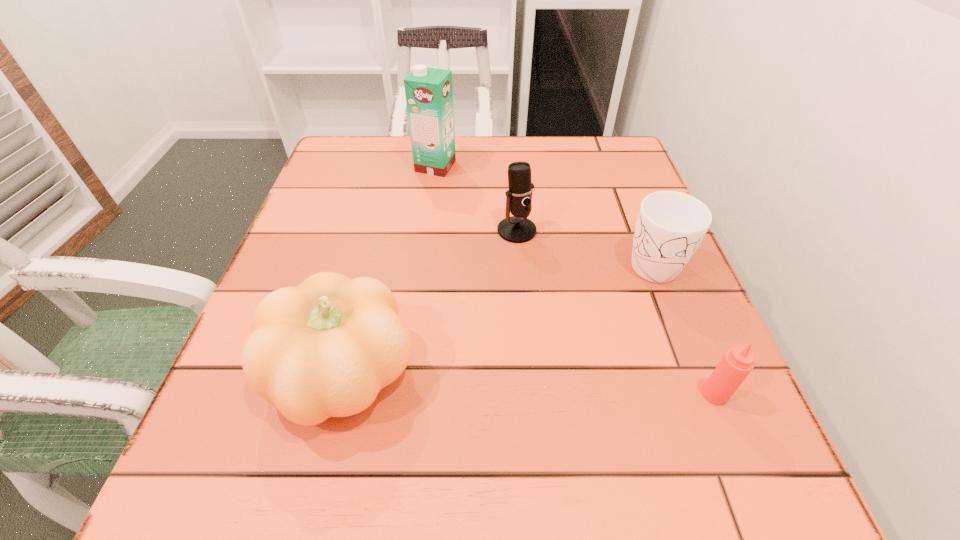
I want to click on carton, so (x=429, y=91).

Find the location of a particular element. the farthest object is located at coordinates (429, 91).

Identify the location of pumpkin. (325, 348).

Image resolution: width=960 pixels, height=540 pixels. Find the location of `microphone`. microphone is located at coordinates (518, 228).

The image size is (960, 540). I want to click on mug, so click(670, 226).

I want to click on Tabasco sauce, so click(x=737, y=363).

You are a GUI agent. You are given a task and a screenshot of the screen. Output one action in this format:
    pyautogui.click(x=<x>, y=<y>)
    Task: Click on the vacant point located on the left of the carton
    
    Given the screenshot: What is the action you would take?
    pyautogui.click(x=375, y=166)

Locate an element on the screen. This screenshot has width=960, height=540. vacant point located 0.270m on the right of the pumpkin is located at coordinates (593, 373).

Where is `vacant space situated on the left of the third object from right to left`? The height and width of the screenshot is (540, 960). vacant space situated on the left of the third object from right to left is located at coordinates (411, 231).

Locate an element on the screen. This screenshot has width=960, height=540. vacant space situated 0.310m on the side of the mug with the handle is located at coordinates (730, 462).